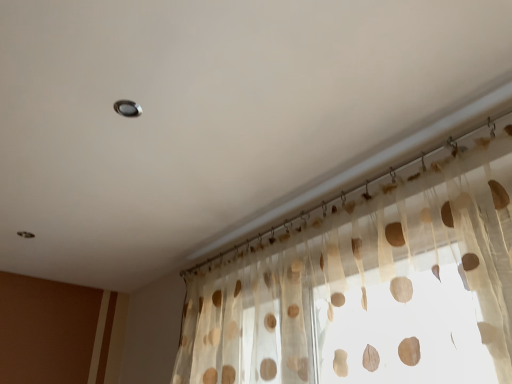
The image size is (512, 384). Describe the element at coordinates (127, 108) in the screenshot. I see `metallic circular light at upper center` at that location.

Find the location of a particular element. metallic circular light at upper center is located at coordinates (127, 108).

The image size is (512, 384). Identify the location of translucent fabric curtain at upper center. (369, 288).

What is the approximate height of translucent fabric curtain at upper center?

translucent fabric curtain at upper center is 1.83 inches tall.

The width and height of the screenshot is (512, 384). What do you see at coordinates (369, 288) in the screenshot?
I see `translucent fabric curtain at upper center` at bounding box center [369, 288].

Locate an element on the screen. This screenshot has width=512, height=384. metallic circular light at upper center is located at coordinates (127, 108).

Considering the positions of objects translucent fabric curtain at upper center and metallic circular light at upper center in the image provided, who is more to the right, translucent fabric curtain at upper center or metallic circular light at upper center?

translucent fabric curtain at upper center.

Which object is further away from the camera taking this photo, translucent fabric curtain at upper center or metallic circular light at upper center?

metallic circular light at upper center is further away from the camera.

Is point (473, 371) in front of point (139, 115)?

Yes, point (473, 371) is in front of point (139, 115).

From the image's perspective, which is below, translucent fabric curtain at upper center or metallic circular light at upper center?

translucent fabric curtain at upper center, from the image's perspective.

From a real-world perspective, which is physically below, translucent fabric curtain at upper center or metallic circular light at upper center?

translucent fabric curtain at upper center is physically lower.

Does translucent fabric curtain at upper center have a lesser width compared to metallic circular light at upper center?

No.

Can you confirm if translucent fabric curtain at upper center is taller than metallic circular light at upper center?

Yes.

Considering the relative sizes of translucent fabric curtain at upper center and metallic circular light at upper center in the image provided, is translucent fabric curtain at upper center bigger than metallic circular light at upper center?

Yes, translucent fabric curtain at upper center is bigger than metallic circular light at upper center.

Is metallic circular light at upper center completely or partially inside translucent fabric curtain at upper center?

No.

Is translucent fabric curtain at upper center far from metallic circular light at upper center?

That's not correct — translucent fabric curtain at upper center is a little close to metallic circular light at upper center.

Could you tell me if translucent fabric curtain at upper center is facing metallic circular light at upper center?

No, translucent fabric curtain at upper center does not turn towards metallic circular light at upper center.

How different are the orientations of translucent fabric curtain at upper center and metallic circular light at upper center in degrees?

There is a 1.01-degree angle between the facing directions of translucent fabric curtain at upper center and metallic circular light at upper center.

Measure the distance between translucent fabric curtain at upper center and metallic circular light at upper center.

A distance of 38.67 inches exists between translucent fabric curtain at upper center and metallic circular light at upper center.

The width and height of the screenshot is (512, 384). In the image, there is a translucent fabric curtain at upper center. Find the location of `light above it (from the image's perspective)`. light above it (from the image's perspective) is located at coordinates (127, 108).

Does metallic circular light at upper center appear on the left side of translucent fabric curtain at upper center?

Indeed, metallic circular light at upper center is positioned on the left side of translucent fabric curtain at upper center.

Which object is more forward, metallic circular light at upper center or translucent fabric curtain at upper center?

translucent fabric curtain at upper center.

Does point (132, 113) appear closer or farther from the camera than point (446, 371)?

Point (132, 113) is farther from the camera than point (446, 371).

From the image's perspective, would you say metallic circular light at upper center is shown under translucent fabric curtain at upper center?

No, from the image's perspective, metallic circular light at upper center is not beneath translucent fabric curtain at upper center.

From a real-world perspective, is metallic circular light at upper center on translucent fabric curtain at upper center?

Yes.

Considering the sizes of objects metallic circular light at upper center and translucent fabric curtain at upper center in the image provided, who is wider, metallic circular light at upper center or translucent fabric curtain at upper center?

Wider between the two is translucent fabric curtain at upper center.

From their relative heights in the image, would you say metallic circular light at upper center is taller or shorter than translucent fabric curtain at upper center?

Clearly, metallic circular light at upper center is shorter compared to translucent fabric curtain at upper center.

In terms of size, does metallic circular light at upper center appear bigger or smaller than translucent fabric curtain at upper center?

metallic circular light at upper center is smaller than translucent fabric curtain at upper center.

Would you say translucent fabric curtain at upper center is part of metallic circular light at upper center's contents?

No, metallic circular light at upper center does not contain translucent fabric curtain at upper center.

Is metallic circular light at upper center directly adjacent to translucent fabric curtain at upper center?

No, metallic circular light at upper center is not in contact with translucent fabric curtain at upper center.

Is translucent fabric curtain at upper center at the back of metallic circular light at upper center?

Yes.

What's the angular difference between metallic circular light at upper center and translucent fabric curtain at upper center's facing directions?

metallic circular light at upper center and translucent fabric curtain at upper center are facing 1.01 degrees away from each other.

Could you measure the distance between metallic circular light at upper center and translucent fabric curtain at upper center?

They are 98.23 centimeters apart.

Where is `curtain located below the metallic circular light at upper center (from the image's perspective)`? The height and width of the screenshot is (384, 512). curtain located below the metallic circular light at upper center (from the image's perspective) is located at coordinates (369, 288).

At what (x,y) coordinates should I click in order to perform the action: click on curtain below the metallic circular light at upper center (from a real-world perspective). Please return your answer as a coordinate pair (x, y). Image resolution: width=512 pixels, height=384 pixels. Looking at the image, I should click on (369, 288).

The height and width of the screenshot is (384, 512). I want to click on light on the left of translucent fabric curtain at upper center, so pyautogui.click(x=127, y=108).